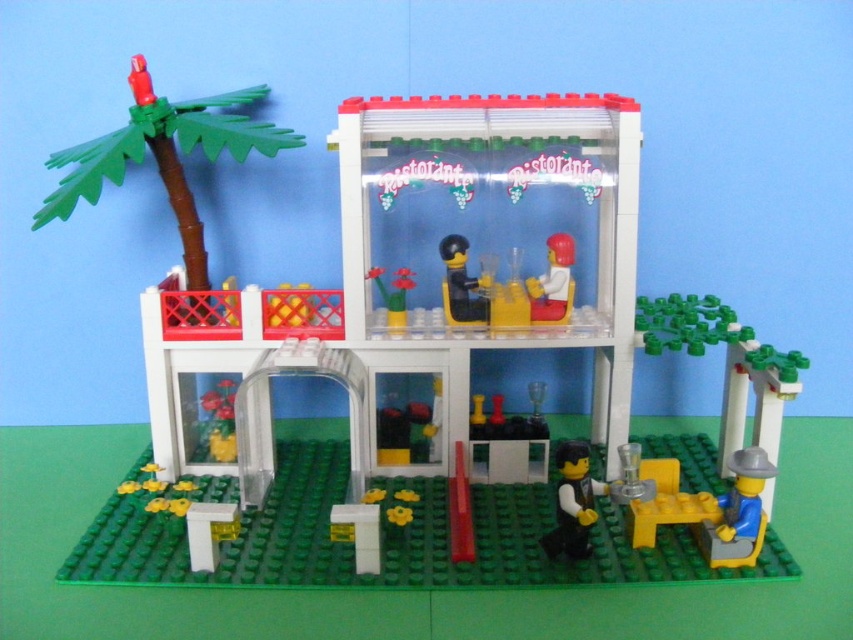
You are a customer at the Ristorante LEGO model and want to grab a cup. You see a smooth black cup at center and a white plastic cup at upper center. Which cup is located to the left side of the other?

The smooth black cup at center is to the left of the white plastic cup at upper center.

You are a photographer standing in front of the Ristorante LEGO model. You want to take a photo that includes both the green matte palm tree at left and the red staircase leading to the second floor. However, your camera has a limited field of view. Based on the scene description, can you position yourself so that both objects are in frame without moving the camera? Explain your reasoning.

The green matte palm tree at left is 1.11 meters away from the camera. Since the red staircase is part of the Ristorante LEGO model and presumably closer to the camera than the palm tree, adjusting the camera angle slightly towards the center of the model would allow both the green matte palm tree at left and the red staircase to be within the field of view.

You are a delivery person standing outside the Ristorante LEGO model. You need to deliver a package to the black plastic figure at lower right. However, you must avoid the green matte palm tree at left. Can you safely navigate around the palm tree to reach the figure?

The green matte palm tree at left is taller than the black plastic figure at lower right, so you can navigate around the base of the palm tree to reach the black plastic figure at lower right without obstruction.